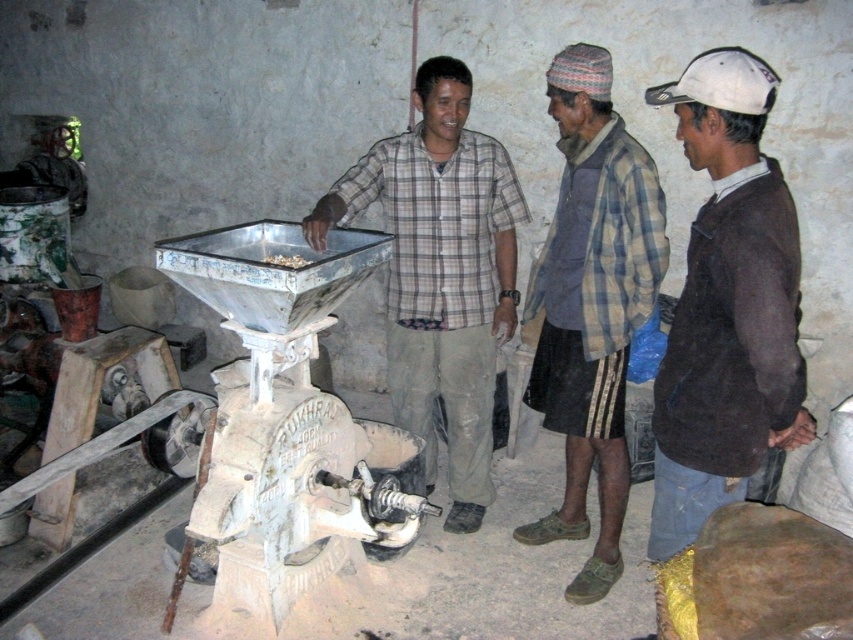
You are a visitor in the workshop and want to know which object is taller between the plaid shirt at center and the white matte food at center. Can you tell me?

The plaid shirt at center is taller than the white matte food at center according to the description.

You are an inspector in the workshop and need to check the distance between the plaid shirt at center and the plaid fabric shirt at center. Which one is closer to you?

The plaid shirt at center is closer to the viewer than the plaid fabric shirt at center.